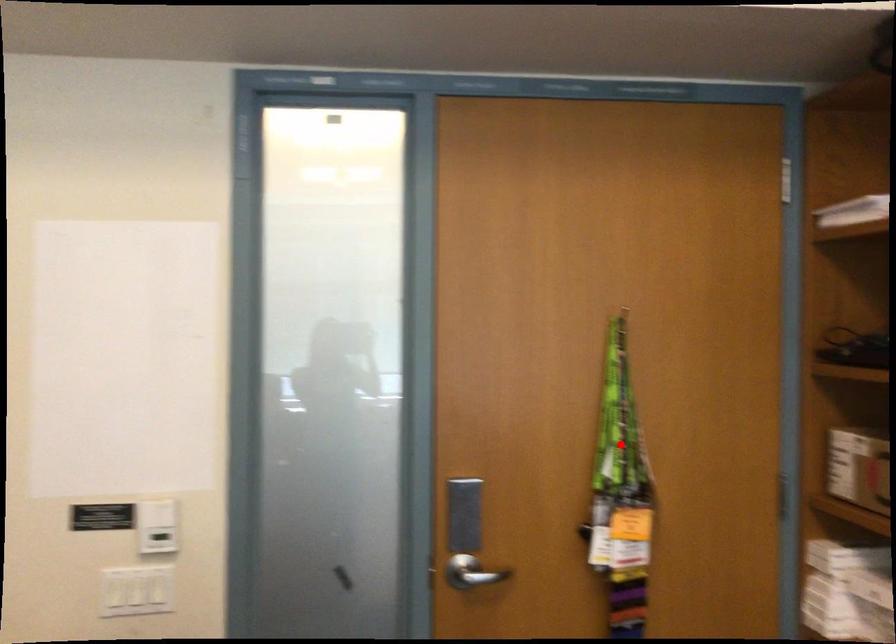
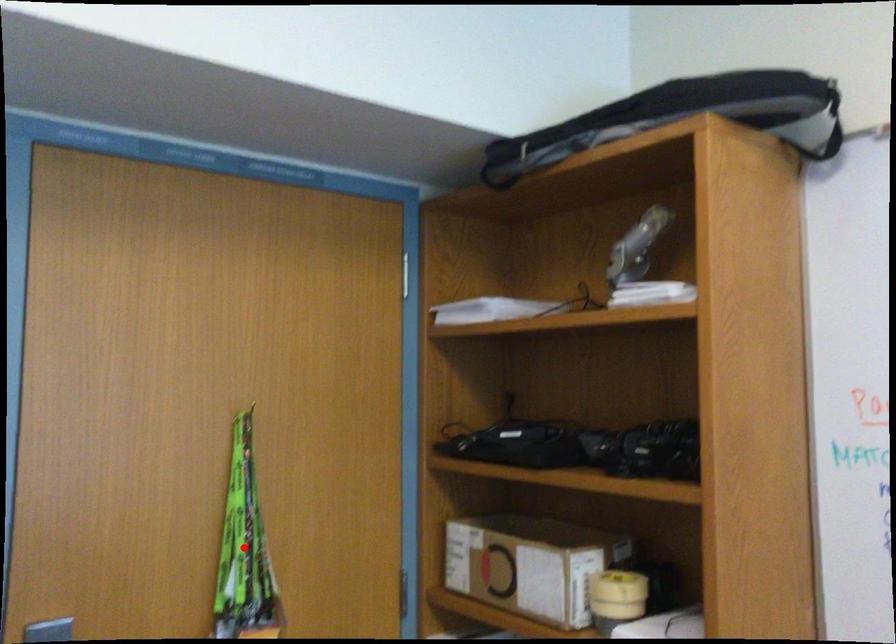
I am providing you with two images of the same scene from different viewpoints. A red point is marked on the first image and another point is marked on the second image. Is the red point in image1 aligned with the point shown in image2?

Yes